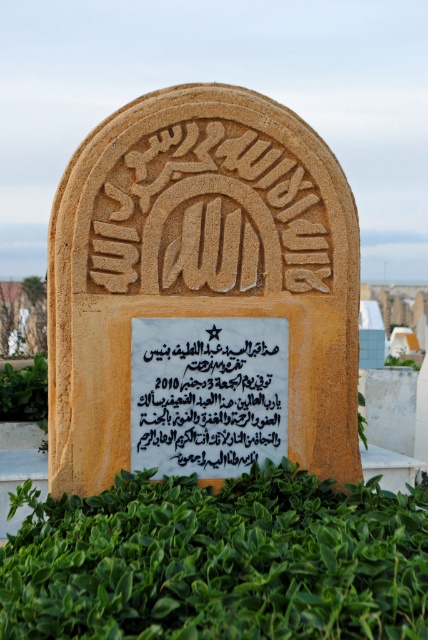
Question: Which point is closer to the camera taking this photo?

Choices:
 (A) (x=36, y=396)
 (B) (x=228, y=369)
 (C) (x=133, y=609)
 (D) (x=333, y=468)

Answer: (C)

Question: Is green leafy hedge at lower center to the right of black paper text at center from the viewer's perspective?

Choices:
 (A) yes
 (B) no

Answer: (A)

Question: Which point is farther to the camera?

Choices:
 (A) 168,378
 (B) 133,260
 (C) 377,541

Answer: (B)

Question: Can you confirm if sandstone gravestone at center is smaller than black paper text at center?

Choices:
 (A) yes
 (B) no

Answer: (B)

Question: Does sandstone gravestone at center have a lesser width compared to green leafy hedge at lower center?

Choices:
 (A) yes
 (B) no

Answer: (A)

Question: Among these points, which one is nearest to the camera?

Choices:
 (A) (151, 445)
 (B) (36, 385)
 (C) (166, 522)

Answer: (C)